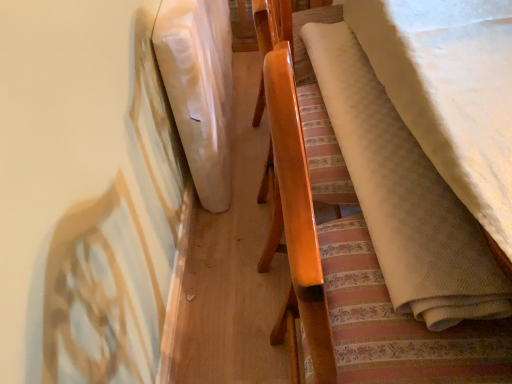
What is the approximate width of matte wood chair at center?

matte wood chair at center is 17.33 inches in width.

Describe the element at coordinates (343, 244) in the screenshot. I see `matte wood chair at center` at that location.

This screenshot has width=512, height=384. What are the coordinates of `matte wood chair at center` in the screenshot? It's located at (343, 244).

This screenshot has height=384, width=512. What do you see at coordinates (199, 89) in the screenshot?
I see `white fabric at upper left` at bounding box center [199, 89].

Measure the distance between point (x=215, y=118) and camera.

The distance of point (x=215, y=118) from camera is 1.48 meters.

Locate an element on the screen. The height and width of the screenshot is (384, 512). white fabric at upper left is located at coordinates (199, 89).

Locate an element on the screen. This screenshot has width=512, height=384. matte wood chair at center is located at coordinates (343, 244).

Based on the photo, considering the positions of objects white fabric at upper left and matte wood chair at center in the image provided, who is more to the right, white fabric at upper left or matte wood chair at center?

matte wood chair at center.

Which is in front, white fabric at upper left or matte wood chair at center?

matte wood chair at center.

Which is behind, point (180, 31) or point (380, 363)?

Point (180, 31)

From the image's perspective, would you say white fabric at upper left is positioned over matte wood chair at center?

Yes, from the image's perspective, white fabric at upper left is on top of matte wood chair at center.

From a real-world perspective, is white fabric at upper left positioned over matte wood chair at center based on gravity?

No.

Which object is wider, white fabric at upper left or matte wood chair at center?

matte wood chair at center.

In the scene shown: Considering the sizes of objects white fabric at upper left and matte wood chair at center in the image provided, who is taller, white fabric at upper left or matte wood chair at center?

Standing taller between the two is matte wood chair at center.

Between white fabric at upper left and matte wood chair at center, which one has smaller size?

white fabric at upper left.

Would you say white fabric at upper left is outside matte wood chair at center?

Yes, white fabric at upper left is outside of matte wood chair at center.

In the scene shown: Can you see white fabric at upper left touching matte wood chair at center?

white fabric at upper left and matte wood chair at center are clearly separated.

Is white fabric at upper left facing towards matte wood chair at center?

No.

Locate an element on the screen. The image size is (512, 384). furniture to the right of white fabric at upper left is located at coordinates (343, 244).

Is matte wood chair at center at the left side of white fabric at upper left?

Incorrect, matte wood chair at center is not on the left side of white fabric at upper left.

Is the position of matte wood chair at center more distant than that of white fabric at upper left?

No.

Considering the points (469, 340) and (210, 97), which point is behind, point (469, 340) or point (210, 97)?

The point (210, 97) is farther.

From the image's perspective, is matte wood chair at center beneath white fabric at upper left?

Yes, from the image's perspective, matte wood chair at center is below white fabric at upper left.

From a real-world perspective, between matte wood chair at center and white fabric at upper left, who is vertically higher?

From a 3D spatial view, matte wood chair at center is above.

Considering the relative sizes of matte wood chair at center and white fabric at upper left in the image provided, is matte wood chair at center wider than white fabric at upper left?

Yes.

From their relative heights in the image, would you say matte wood chair at center is taller or shorter than white fabric at upper left?

Clearly, matte wood chair at center is taller compared to white fabric at upper left.

Can you confirm if matte wood chair at center is smaller than white fabric at upper left?

No, matte wood chair at center is not smaller than white fabric at upper left.

Can white fabric at upper left be found inside matte wood chair at center?

That's incorrect, white fabric at upper left is not inside matte wood chair at center.

Are matte wood chair at center and white fabric at upper left making contact?

No, matte wood chair at center is not beside white fabric at upper left.

Is matte wood chair at center oriented away from white fabric at upper left?

matte wood chair at center is not turned away from white fabric at upper left.

How different are the orientations of matte wood chair at center and white fabric at upper left in degrees?

The angle between the facing direction of matte wood chair at center and the facing direction of white fabric at upper left is 0.44 degrees.

You are a GUI agent. You are given a task and a screenshot of the screen. Output one action in this format:
    pyautogui.click(x=<x>, y=<y>)
    Task: Click on the blanket that is behind the matte wood chair at center
    Image resolution: width=512 pixels, height=384 pixels.
    Given the screenshot: What is the action you would take?
    tap(199, 89)

Image resolution: width=512 pixels, height=384 pixels. What are the coordinates of `blanket above the matte wood chair at center (from the image's perspective)` in the screenshot? It's located at (199, 89).

Identify the location of blanket lying behind the matte wood chair at center. (199, 89).